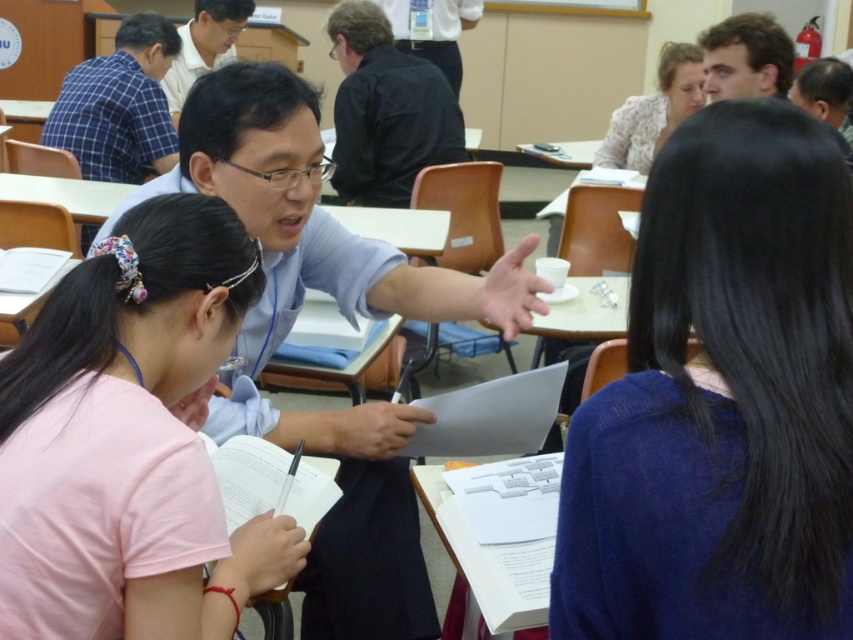
Question: Can you confirm if blue sheer blouse at center is smaller than smooth brown hair at upper right?

Choices:
 (A) yes
 (B) no

Answer: (B)

Question: Which point appears closest to the camera in this image?

Choices:
 (A) (425, 74)
 (B) (167, 472)

Answer: (B)

Question: Among these objects, which one is farthest from the camera?

Choices:
 (A) matte black shirt at upper center
 (B) black shirt at center
 (C) blue checkered shirt at upper left
 (D) pink fabric shirt at upper left

Answer: (A)

Question: Does pink fabric shirt at upper left have a lesser width compared to smooth brown hair at upper right?

Choices:
 (A) no
 (B) yes

Answer: (A)

Question: Which object appears farthest from the camera in this image?

Choices:
 (A) smooth brown hair at upper right
 (B) matte blue shirt at center
 (C) pink fabric shirt at upper left

Answer: (A)

Question: Can you confirm if floral fabric blouse at upper right is positioned below matte black shirt at upper center?

Choices:
 (A) yes
 (B) no

Answer: (A)